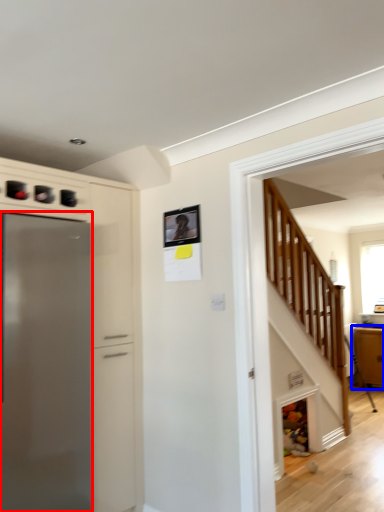
Question: Among these objects, which one is farthest to the camera, refrigerator (highlighted by a red box) or cabinetry (highlighted by a blue box)?

Choices:
 (A) refrigerator
 (B) cabinetry

Answer: (B)